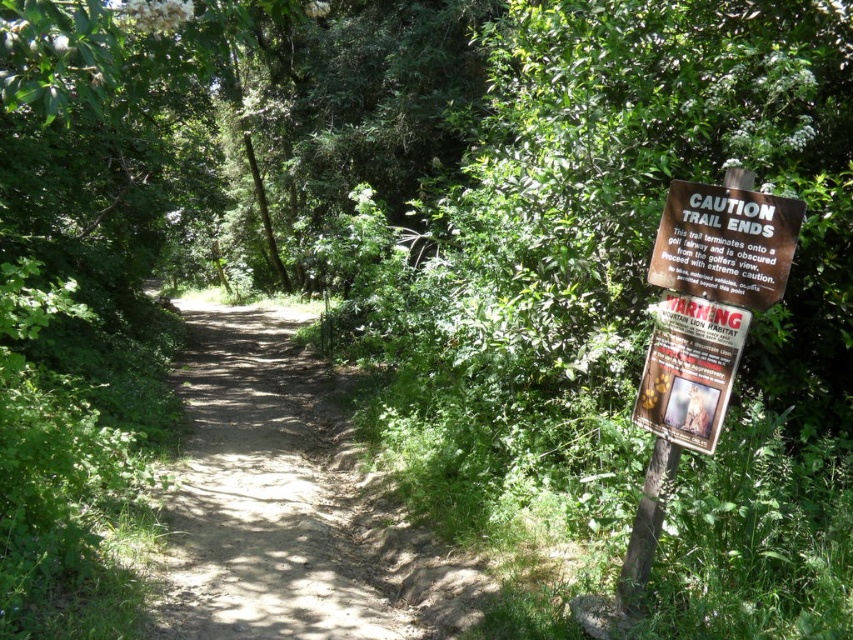
You are a hiker walking along the forest trail and see the brown wooden sign at right. If you want to reach the sign, which direction should you move relative to your current position on the trail?

The brown wooden sign at right is located at point 0.381 on the x axis and 0.851 on the y axis, so you should move to the right and forward along the trail to reach it.

You are a hiker on the dirt path at center and see the wooden sign at right. Which object is closer to you?

The dirt path at center is closer to you than the wooden sign at right because it is further away.